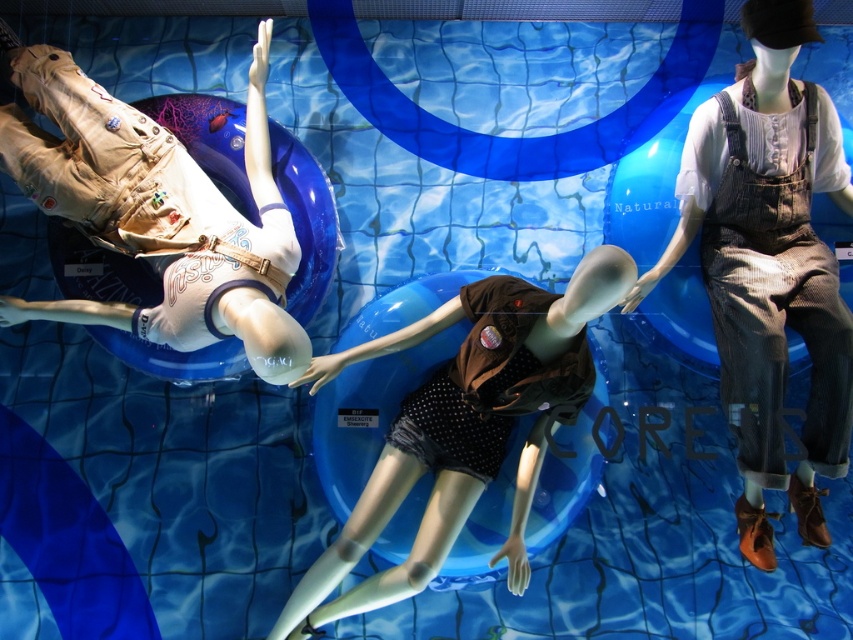
You are a customer standing in front of the display window. You see the denim overalls at right and the brown dotted fabric at center. Which item is closer to you?

The denim overalls at right are closer to you because they are further to the viewer than the brown dotted fabric at center.

You are standing in front of the display window and want to place a new accessory between the denim overalls at right and the matte khaki pants at left. Which side should you place it on to ensure it is between them?

To place the accessory between the denim overalls at right and the matte khaki pants at left, you should position it to the right of the matte khaki pants at left and to the left of the denim overalls at right, as the denim overalls at right is located to the right of the matte khaki pants at left.

You are a customer trying to decide between the denim overalls at right and the matte khaki pants at left. Based on their appearance in the display, which item would you choose if you prefer something more slender in fit?

The denim overalls at right are thinner than the matte khaki pants at left, so you should choose the denim overalls at right for a slimmer fit.